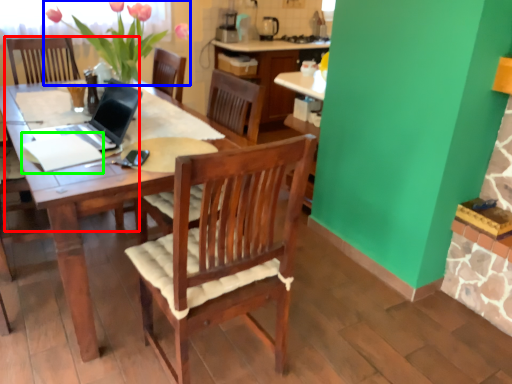
Question: Considering the real-world distances, which object is closest to armchair (highlighted by a red box)? floral arrangement (highlighted by a blue box) or notepad (highlighted by a green box).

Choices:
 (A) floral arrangement
 (B) notepad

Answer: (A)